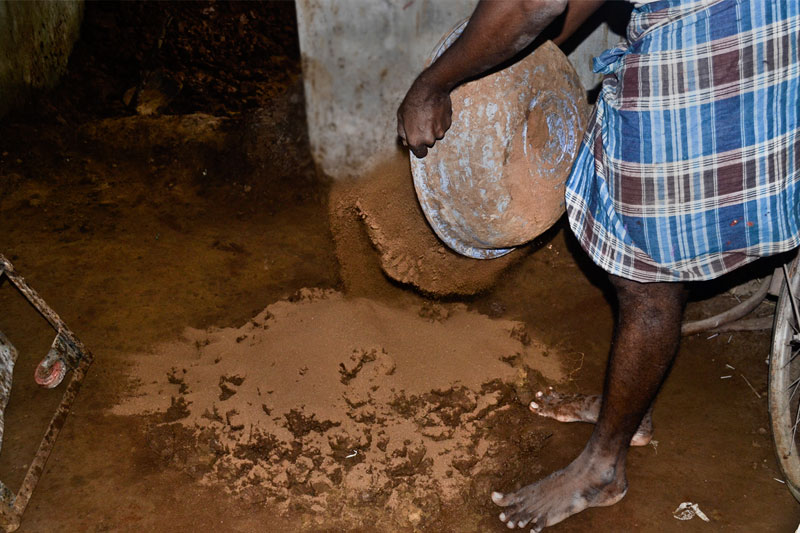
Identify the location of bowl. The image size is (800, 533). (490, 229).